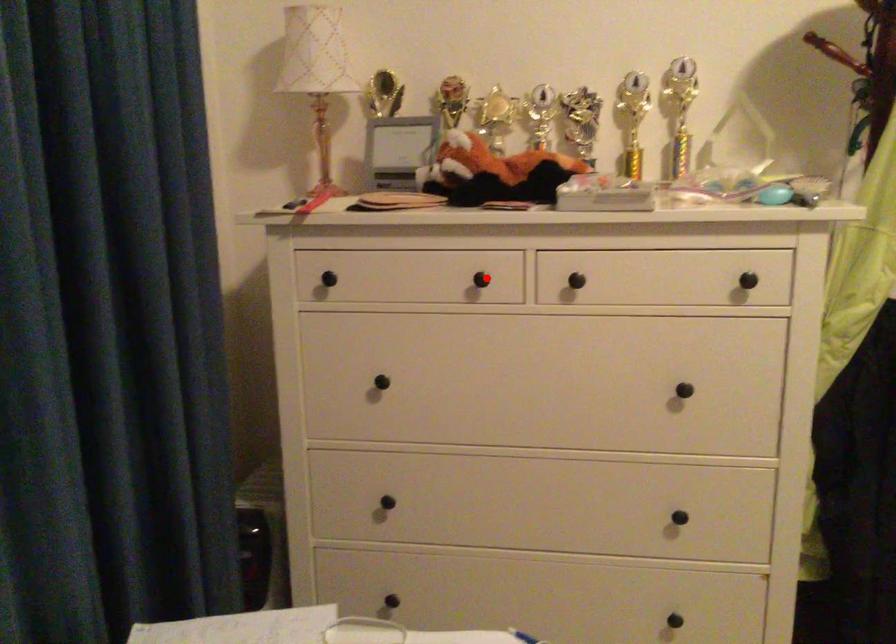
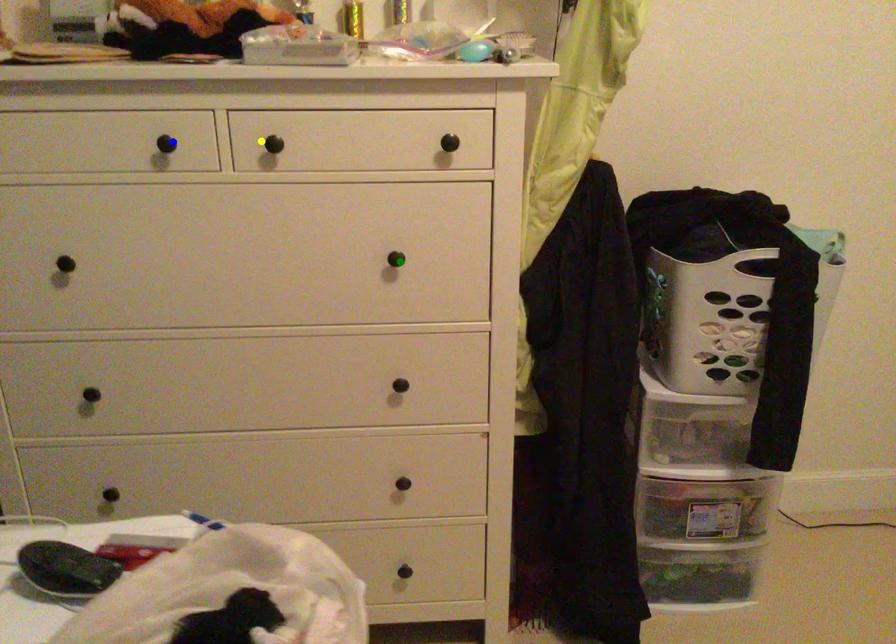
Question: I am providing you with two images of the same scene from different viewpoints. A red point is marked on the first image. You are given multiple points on the second image. Which point in image 2 represents the same 3d spot as the red point in image 1?

Choices:
 (A) blue point
 (B) yellow point
 (C) green point

Answer: (A)